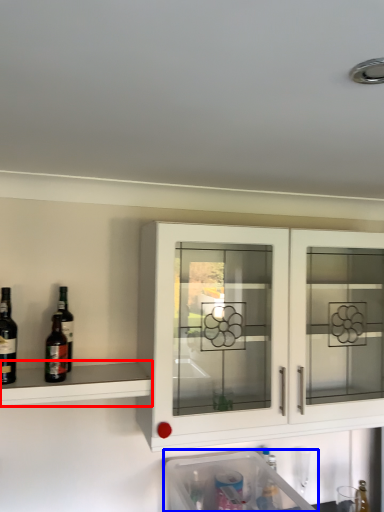
Question: Which object is closer to the camera taking this photo, shelf (highlighted by a red box) or dish washer (highlighted by a blue box)?

Choices:
 (A) shelf
 (B) dish washer

Answer: (B)